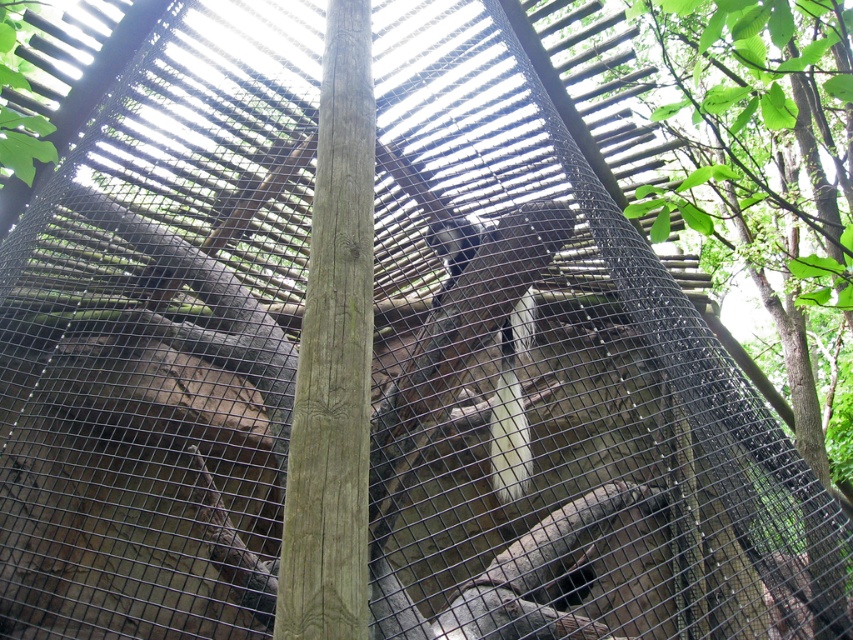
Question: Which point is farther to the camera?

Choices:
 (A) smooth brown wood pole at center
 (B) white fur monkey at center

Answer: (B)

Question: Does smooth brown wood pole at center have a lesser width compared to white fur monkey at center?

Choices:
 (A) no
 (B) yes

Answer: (B)

Question: Where is smooth brown wood pole at center located in relation to white fur monkey at center in the image?

Choices:
 (A) below
 (B) above

Answer: (B)

Question: Does smooth brown wood pole at center come behind white fur monkey at center?

Choices:
 (A) no
 (B) yes

Answer: (A)

Question: Which of the following is the closest to the observer?

Choices:
 (A) white fur monkey at center
 (B) smooth brown wood pole at center

Answer: (B)

Question: Which point is farther from the camera taking this photo?

Choices:
 (A) (527, 470)
 (B) (326, 349)

Answer: (A)